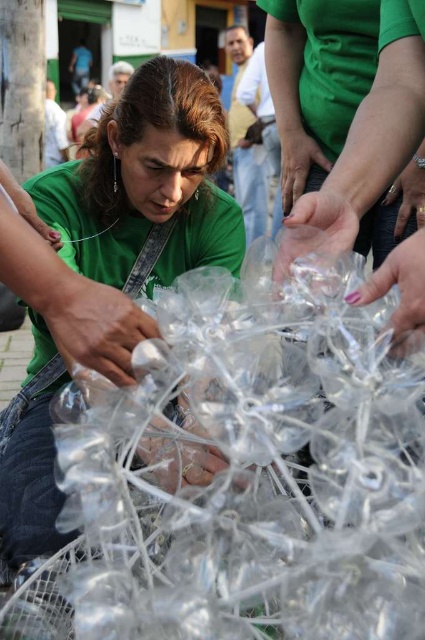
You are a recycling worker who needs to determine which item is easier to see through. Based on the scene, which one would you choose between the transparent plastic at center and the green matte shirt at center?

The transparent plastic at center is thinner than the green matte shirt at center, so it is easier to see through the transparent plastic at center.